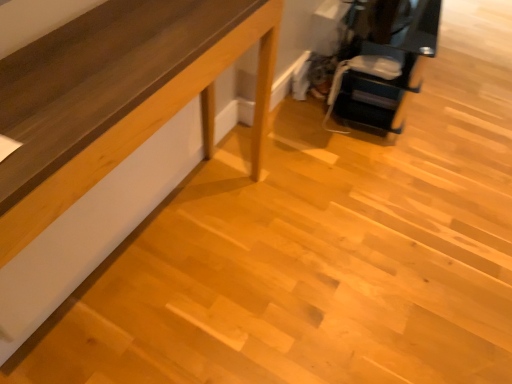
Question: Visually, is light brown wood table at lower left, which is the second furniture in top-to-bottom order, positioned to the left or to the right of matte black printer at upper right, marked as the 2th furniture in a bottom-to-top arrangement?

Choices:
 (A) left
 (B) right

Answer: (A)

Question: Relative to matte black printer at upper right, positioned as the first furniture in top-to-bottom order, is light brown wood table at lower left, which is the second furniture in top-to-bottom order, in front or behind?

Choices:
 (A) behind
 (B) front

Answer: (B)

Question: Is light brown wood table at lower left, the first furniture when ordered from left to right, bigger or smaller than matte black printer at upper right, placed as the 1th furniture when sorted from right to left?

Choices:
 (A) big
 (B) small

Answer: (B)

Question: Relative to light brown wood table at lower left, the first furniture when ordered from left to right, is matte black printer at upper right, marked as the 2th furniture in a bottom-to-top arrangement, in front or behind?

Choices:
 (A) behind
 (B) front

Answer: (A)

Question: Is point (378, 76) positioned closer to the camera than point (266, 77)?

Choices:
 (A) closer
 (B) farther

Answer: (B)

Question: Is matte black printer at upper right, placed as the 1th furniture when sorted from right to left, wider or thinner than light brown wood table at lower left, acting as the 1th furniture starting from the bottom?

Choices:
 (A) wide
 (B) thin

Answer: (A)

Question: Visually, is matte black printer at upper right, placed as the 1th furniture when sorted from right to left, positioned to the left or to the right of light brown wood table at lower left, the first furniture when ordered from left to right?

Choices:
 (A) right
 (B) left

Answer: (A)